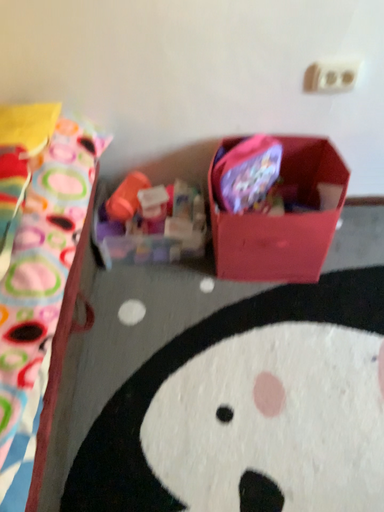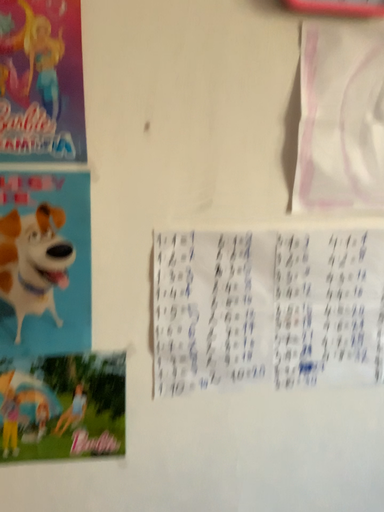
Question: Which way did the camera rotate in the video?

Choices:
 (A) rotated left
 (B) rotated right

Answer: (B)